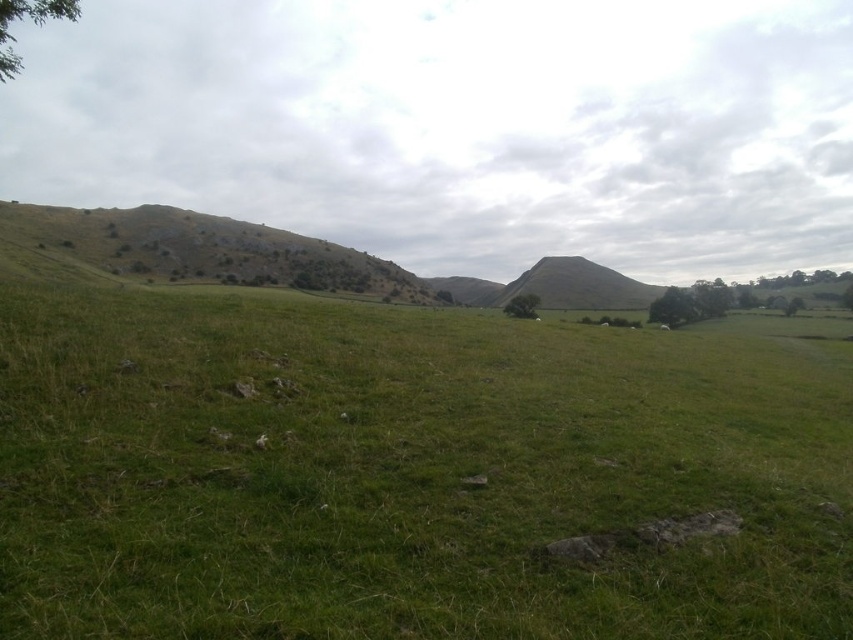
You are standing at the base of the green grassy hillside at center and want to reach the top. Given that the average human walking pace is 1.4 meters per second, how many minutes will it take you to climb the hill if you maintain this pace?

The distance between the green grassy hillside at center and the viewer is 223.15 meters. At a pace of 1.4 meters per second, it would take approximately 223.15 divided by 1.4 equals approximately 159.39 seconds, which is roughly 2.66 minutes. So, it would take about 2.66 minutes to climb the hill.

You are standing in the middle of the grassy field and want to walk towards the green leafy tree at right and the green leafy tree at center. Which tree should you head towards if you want to reach the taller one first?

The green leafy tree at right is taller than the green leafy tree at center, so you should head towards the green leafy tree at right to reach the taller one first.